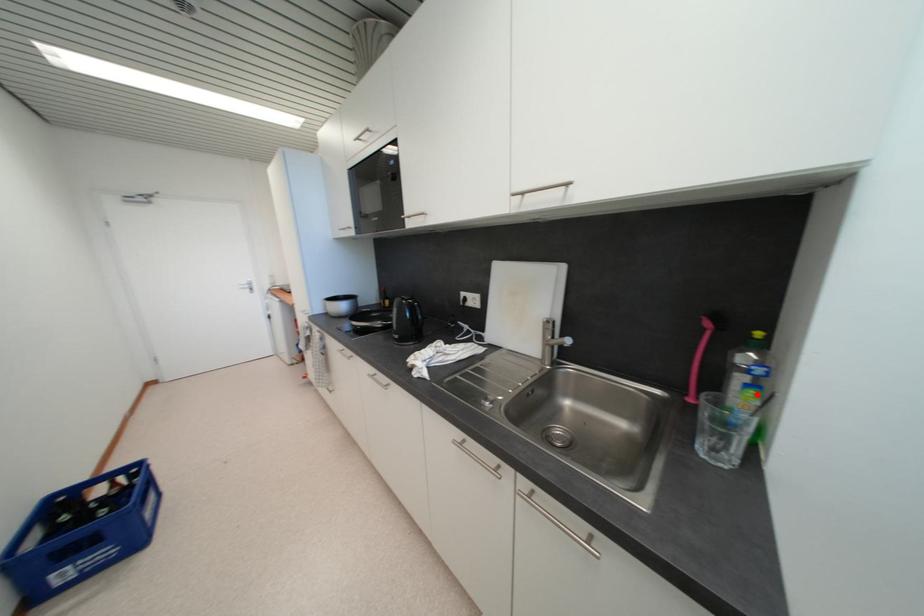
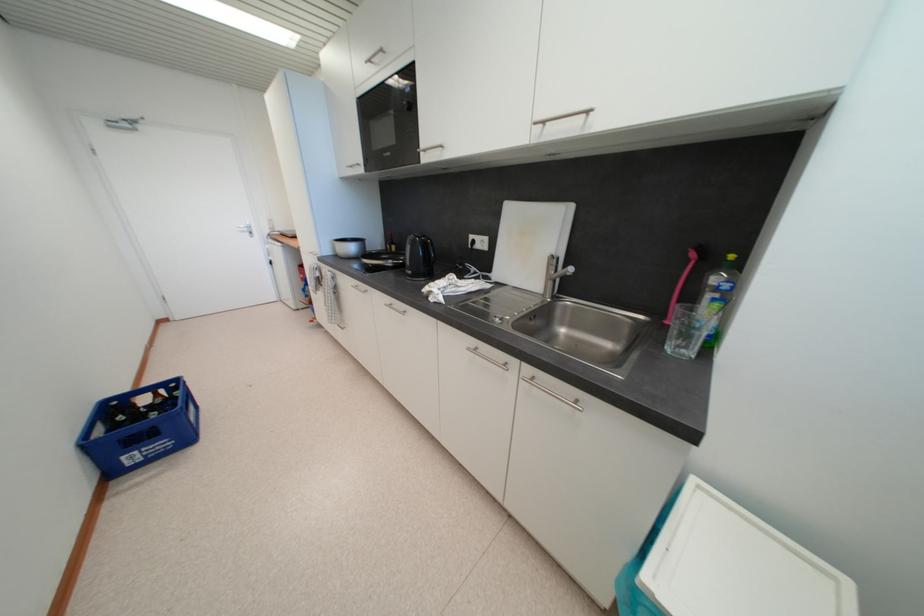
In the second image, find the point that corresponds to the highlighted location in the first image.

(723, 307)